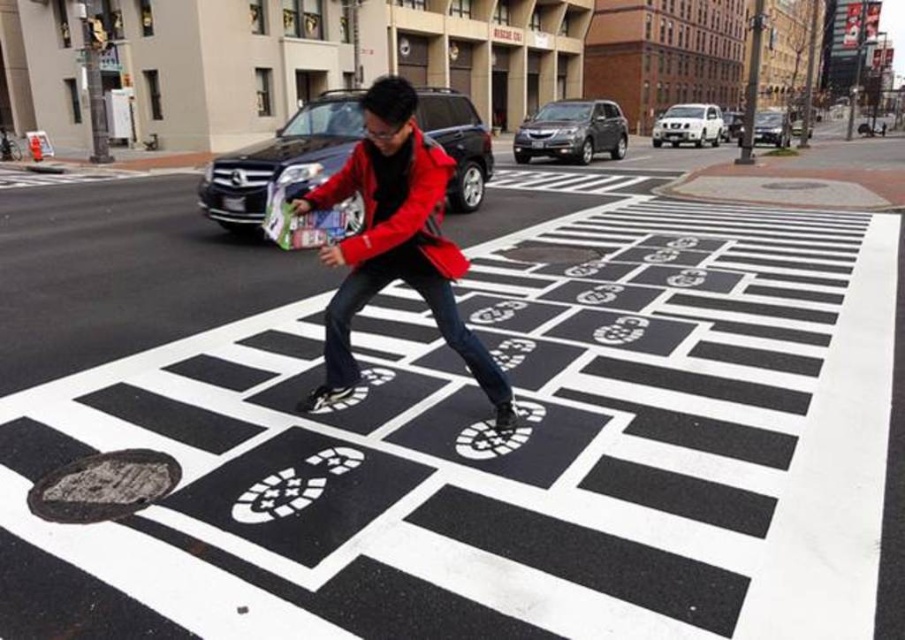
Question: Which point is closer to the camera taking this photo?

Choices:
 (A) (405, 257)
 (B) (389, 228)

Answer: (B)

Question: Is black asphalt at center below red matte jacket at center?

Choices:
 (A) no
 (B) yes

Answer: (B)

Question: Is black asphalt at center positioned at the back of matte red jacket at center?

Choices:
 (A) yes
 (B) no

Answer: (B)

Question: Which point is farther to the camera?

Choices:
 (A) matte red jacket at center
 (B) black asphalt at center

Answer: (A)

Question: Which of the following is the farthest from the observer?

Choices:
 (A) (432, 148)
 (B) (373, 497)

Answer: (A)

Question: Does black asphalt at center appear under matte red jacket at center?

Choices:
 (A) no
 (B) yes

Answer: (B)